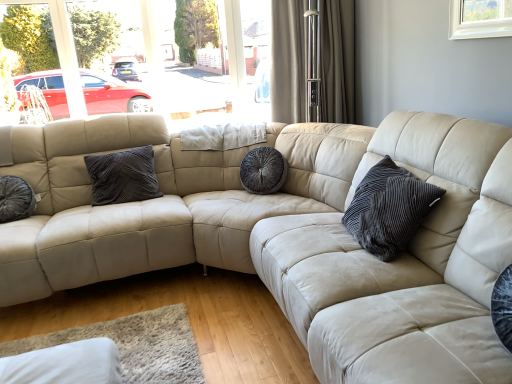
Question: Is beige textured curtain at upper center to the left or to the right of velvet dark gray pillow at center, the first pillow positioned from the front, in the image?

Choices:
 (A) right
 (B) left

Answer: (B)

Question: From the image's perspective, is beige textured curtain at upper center located above or below velvet dark gray pillow at center, marked as the 3th pillow in a back-to-front arrangement?

Choices:
 (A) below
 (B) above

Answer: (B)

Question: Which object is positioned farthest from the beige textured curtain at upper center?

Choices:
 (A) beige leather couch at center
 (B) velvet dark gray pillow at left, the 1th pillow viewed from the left
 (C) velvet dark gray pillow at center, marked as the 3th pillow in a back-to-front arrangement
 (D) dark grey velvet pillow at center, which appears as the 3th pillow when viewed from the front

Answer: (B)

Question: Which of these objects is positioned closest to the beige leather couch at center?

Choices:
 (A) beige textured curtain at upper center
 (B) dark grey velvet pillow at center, arranged as the second pillow when viewed from the right
 (C) velvet dark gray pillow at left, the 1th pillow viewed from the left
 (D) velvet dark gray pillow at center, the first pillow positioned from the front

Answer: (D)